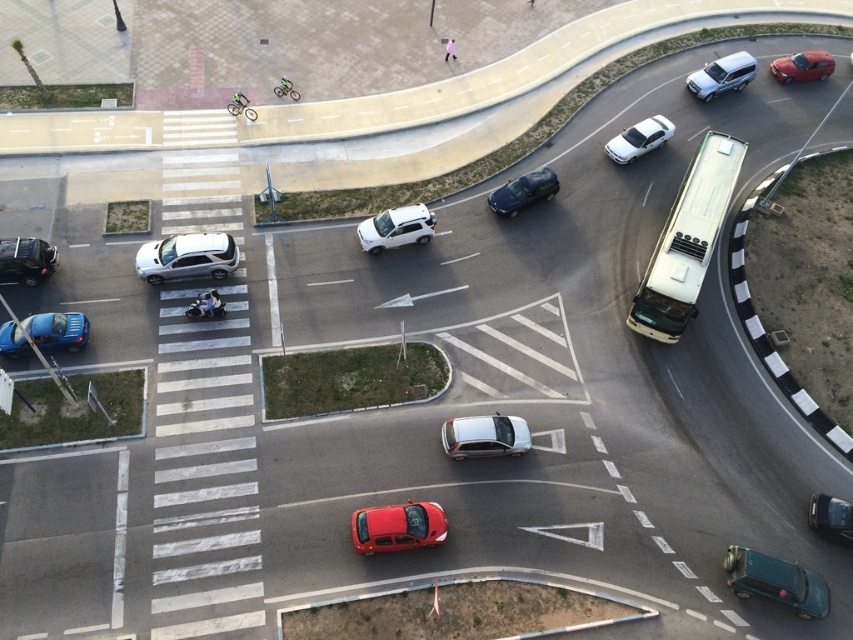
Is white metallic bus at right above matte black bicycle at upper left?

Actually, white metallic bus at right is below matte black bicycle at upper left.

Locate an element on the screen. white metallic bus at right is located at coordinates (686, 241).

Who is more forward, (x=735, y=138) or (x=276, y=88)?

Point (x=735, y=138)

Image resolution: width=853 pixels, height=640 pixels. Identify the location of white metallic bus at right. (686, 241).

Which of these two, white metallic bus at right or white glossy sedan at upper right, stands shorter?

Standing shorter between the two is white glossy sedan at upper right.

What do you see at coordinates (686, 241) in the screenshot? I see `white metallic bus at right` at bounding box center [686, 241].

At what (x,y) coordinates should I click in order to perform the action: click on white metallic bus at right. Please return your answer as a coordinate pair (x, y). Image resolution: width=853 pixels, height=640 pixels. Looking at the image, I should click on (686, 241).

What are the coordinates of `shiny red sedan at lower center` in the screenshot? It's located at (397, 525).

Which of these two, shiny red sedan at lower center or matte black car at left, stands taller?

matte black car at left

Is point (433, 506) closer to viewer compared to point (22, 276)?

That is True.

Locate an element on the screen. The image size is (853, 640). shiny red sedan at lower center is located at coordinates (397, 525).